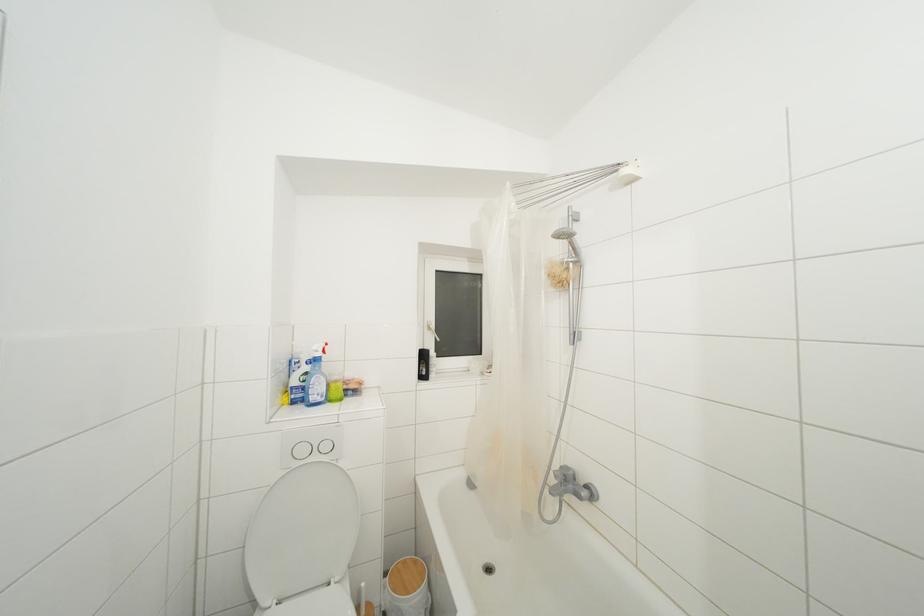
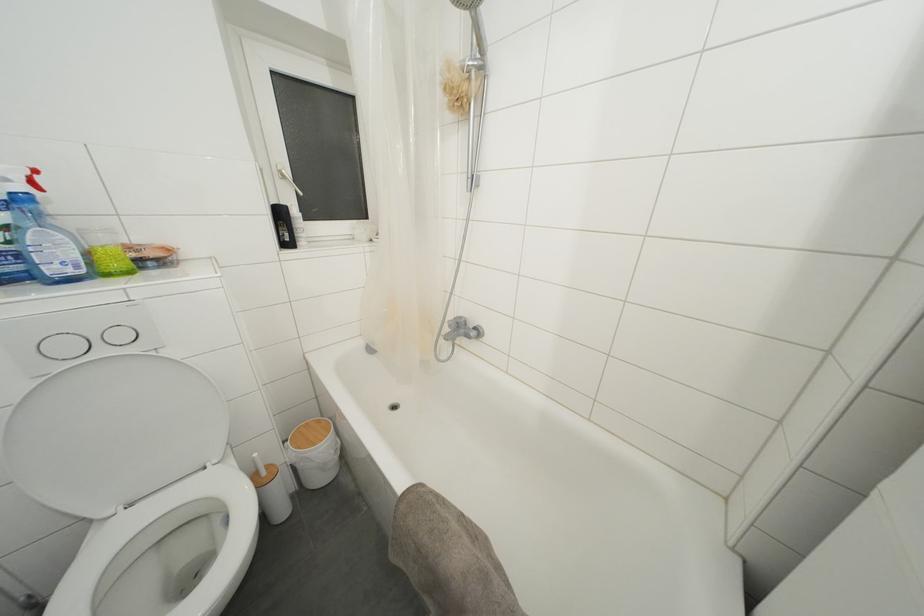
The point at (307, 456) is marked in the first image. Where is the corresponding point in the second image?

(71, 352)